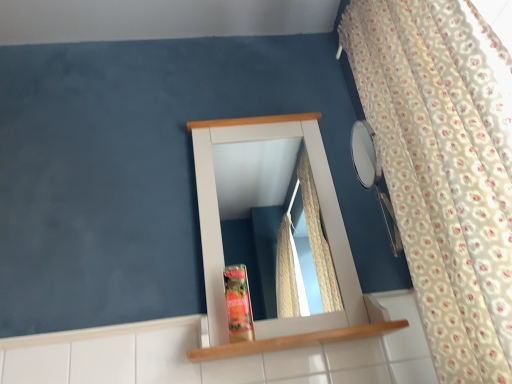
This screenshot has height=384, width=512. What do you see at coordinates (294, 341) in the screenshot? I see `wooden shelf at center` at bounding box center [294, 341].

Identify the location of wooden shelf at center. (294, 341).

This screenshot has width=512, height=384. I want to click on white wood medicine cabinet at center, so pyautogui.click(x=255, y=180).

What do you see at coordinates (238, 304) in the screenshot? I see `matte plastic toiletry at center` at bounding box center [238, 304].

In order to face white glossy mirror at center, should I rotate leftwards or rightwards?

Turn left approximately 9.181 degrees to face it.

The width and height of the screenshot is (512, 384). Identify the location of white floral fabric curtain at right. (444, 168).

In the scene shown: Which point is more distant from viewer, (215, 205) or (247, 328)?

The point (215, 205) is farther from the camera.

Based on the photo, is matte plastic toiletry at center at the back of white wood medicine cabinet at center?

Yes, white wood medicine cabinet at center's orientation is away from matte plastic toiletry at center.

Based on the photo, which of these two, white wood medicine cabinet at center or matte plastic toiletry at center, is bigger?

white wood medicine cabinet at center.

Based on the photo, is there a large distance between white wood medicine cabinet at center and matte plastic toiletry at center?

Actually, white wood medicine cabinet at center and matte plastic toiletry at center are a little close together.

Is wooden shelf at center looking in the opposite direction of white glossy mirror at center?

Yes, wooden shelf at center is positioned with its back facing white glossy mirror at center.

From their relative heights in the image, would you say wooden shelf at center is taller or shorter than white glossy mirror at center?

wooden shelf at center is shorter than white glossy mirror at center.

From a real-world perspective, is wooden shelf at center positioned above or below white glossy mirror at center?

Clearly, from a real-world perspective, wooden shelf at center is below white glossy mirror at center.

Is wooden shelf at center in front of or behind white glossy mirror at center in the image?

Visually, wooden shelf at center is located behind white glossy mirror at center.

From the image's perspective, is white floral fabric curtain at right above or below matte plastic toiletry at center?

Clearly, from the image's perspective, white floral fabric curtain at right is above matte plastic toiletry at center.

Which of these two, white floral fabric curtain at right or matte plastic toiletry at center, stands taller?

white floral fabric curtain at right is taller.

How much distance is there between white floral fabric curtain at right and matte plastic toiletry at center?

20.58 inches.

From a real-world perspective, is white floral fabric curtain at right physically above matte plastic toiletry at center?

Yes.

Considering the relative sizes of matte plastic toiletry at center and wooden shelf at center in the image provided, is matte plastic toiletry at center bigger than wooden shelf at center?

No, matte plastic toiletry at center is not bigger than wooden shelf at center.

Is matte plastic toiletry at center not near wooden shelf at center?

No, matte plastic toiletry at center is in close proximity to wooden shelf at center.

Is matte plastic toiletry at center aimed at wooden shelf at center?

No, matte plastic toiletry at center is not aimed at wooden shelf at center.

Is point (240, 281) positioned behind point (234, 356)?

Yes, point (240, 281) is farther from viewer.

Can you confirm if wooden shelf at center is shorter than white floral fabric curtain at right?

Yes, wooden shelf at center is shorter than white floral fabric curtain at right.

What's the angular difference between wooden shelf at center and white floral fabric curtain at right's facing directions?

The angular difference between wooden shelf at center and white floral fabric curtain at right is 90.4 degrees.

In the image, is wooden shelf at center positioned in front of or behind white floral fabric curtain at right?

Clearly, wooden shelf at center is behind white floral fabric curtain at right.

Does white wood medicine cabinet at center have a greater width compared to white floral fabric curtain at right?

Incorrect, the width of white wood medicine cabinet at center does not surpass that of white floral fabric curtain at right.

Can you tell me how much white wood medicine cabinet at center and white floral fabric curtain at right differ in facing direction?

They differ by 90.8 degrees in their facing directions.

Considering the relative positions of white wood medicine cabinet at center and white floral fabric curtain at right in the image provided, is white wood medicine cabinet at center in front of white floral fabric curtain at right?

No, white wood medicine cabinet at center is behind white floral fabric curtain at right.

From the picture: From the image's perspective, which one is positioned lower, white wood medicine cabinet at center or white floral fabric curtain at right?

white wood medicine cabinet at center appears lower in the image.

Between white glossy mirror at center and wooden shelf at center, which one has more height?

With more height is white glossy mirror at center.

From the image's perspective, is white glossy mirror at center under wooden shelf at center?

Actually, white glossy mirror at center appears above wooden shelf at center in the image.

Is white glossy mirror at center oriented towards wooden shelf at center?

→ Yes.

What are the coordinates of `medicine cabinet located above the matte plastic toiletry at center (from the image's perspective)` in the screenshot? It's located at 255,180.

This screenshot has width=512, height=384. What are the coordinates of `shelf behind the white glossy mirror at center` in the screenshot? It's located at (294, 341).

Looking at the image, which one is located further to white glossy mirror at center, white wood medicine cabinet at center or matte plastic toiletry at center?

matte plastic toiletry at center is positioned further to the anchor white glossy mirror at center.

Which object lies further to the anchor point wooden shelf at center, white wood medicine cabinet at center or matte plastic toiletry at center?

white wood medicine cabinet at center is further to wooden shelf at center.

When comparing their distances from white glossy mirror at center, does white floral fabric curtain at right or matte plastic toiletry at center seem further?

The object further to white glossy mirror at center is white floral fabric curtain at right.

Considering their positions, is white glossy mirror at center positioned closer to white floral fabric curtain at right than matte plastic toiletry at center?

matte plastic toiletry at center.

When comparing their distances from wooden shelf at center, does white wood medicine cabinet at center or white glossy mirror at center seem further?

The object further to wooden shelf at center is white glossy mirror at center.

When comparing their distances from white glossy mirror at center, does matte plastic toiletry at center or white floral fabric curtain at right seem further?

The object further to white glossy mirror at center is white floral fabric curtain at right.

When comparing their distances from white floral fabric curtain at right, does white glossy mirror at center or wooden shelf at center seem closer?

Among the two, wooden shelf at center is located nearer to white floral fabric curtain at right.

Which object lies further to the anchor point white glossy mirror at center, wooden shelf at center or white wood medicine cabinet at center?

wooden shelf at center lies further to white glossy mirror at center than the other object.

At what (x,y) coordinates should I click in order to perform the action: click on shelf between white floral fabric curtain at right and matte plastic toiletry at center in the front-back direction. Please return your answer as a coordinate pair (x, y). The image size is (512, 384). Looking at the image, I should click on (294, 341).

What are the coordinates of `medicine cabinet between white floral fabric curtain at right and matte plastic toiletry at center along the z-axis` in the screenshot? It's located at (255, 180).

What are the coordinates of `backdrop between white floral fabric curtain at right and white wood medicine cabinet at center in the front-back direction` in the screenshot? It's located at (149, 170).

Where is `shelf positioned between white floral fabric curtain at right and white wood medicine cabinet at center from near to far`? The height and width of the screenshot is (384, 512). shelf positioned between white floral fabric curtain at right and white wood medicine cabinet at center from near to far is located at coordinates (294, 341).